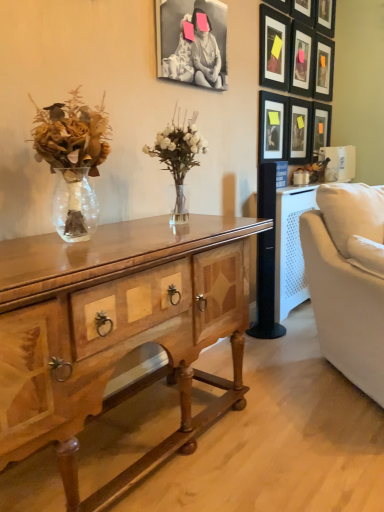
What are the coordinates of `vacant space underneath wooden desk at center (from a real-world perspective)` in the screenshot? It's located at (112, 445).